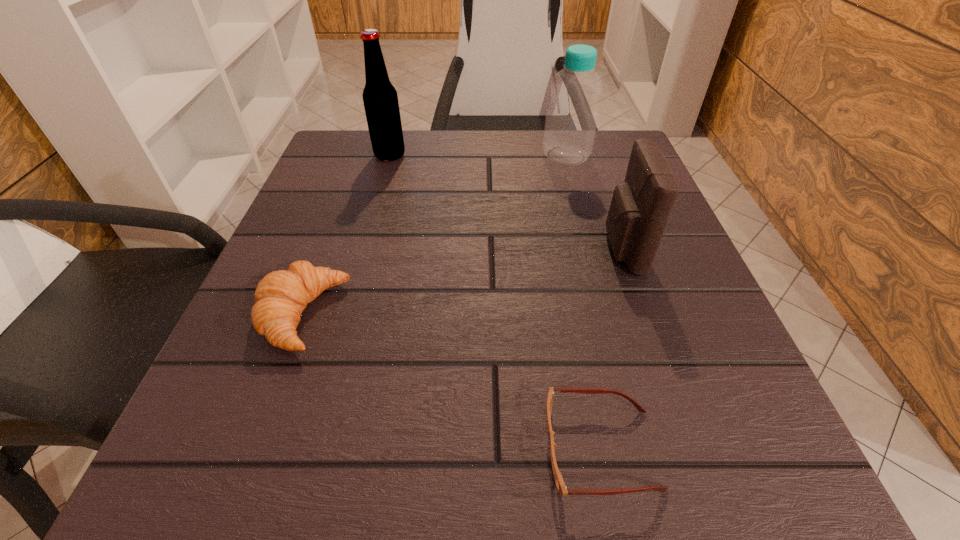
Locate an element on the screen. This screenshot has width=960, height=540. bottle situated at the right edge is located at coordinates (571, 121).

Locate an element on the screen. This screenshot has height=540, width=960. pouch that is at the right edge is located at coordinates (640, 207).

You are a GUI agent. You are given a task and a screenshot of the screen. Output one action in this format:
    pyautogui.click(x=<x>, y=<y>)
    Task: Click on the spectacles located in the right edge section of the desktop
    
    Given the screenshot: What is the action you would take?
    pyautogui.click(x=560, y=484)

Identify the location of object that is at the far left corner. (380, 98).

Locate an element on the screen. object that is positioned at the far right corner is located at coordinates (571, 121).

Find the location of a particular element. object present at the near right corner is located at coordinates (560, 484).

Locate an element on the screen. vacant space at the far edge of the desktop is located at coordinates (468, 162).

I want to click on blank area at the near edge, so click(x=335, y=444).

This screenshot has height=540, width=960. What are the coordinates of `free space at the left edge` in the screenshot? It's located at (342, 286).

Identify the location of vacant area at the right edge of the desktop. (658, 427).